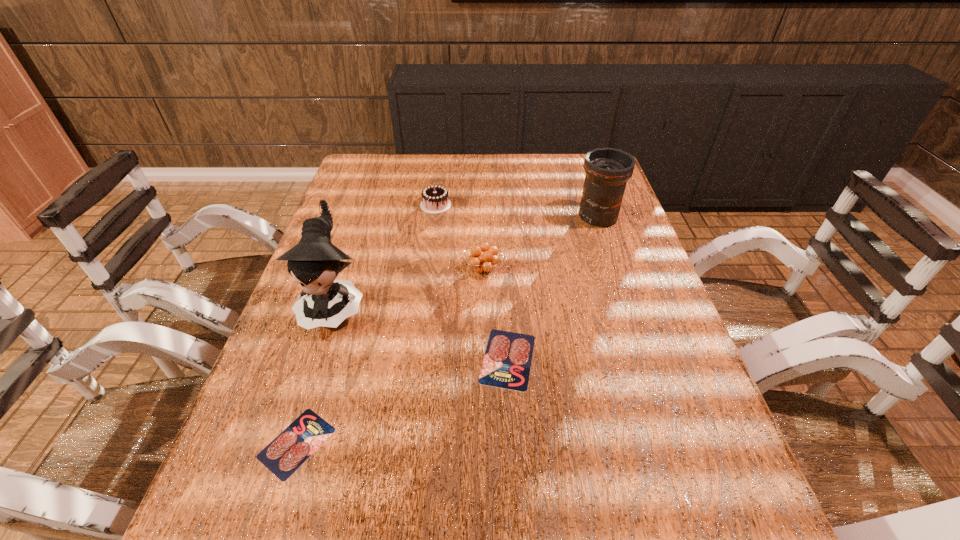
At what (x,y) coordinates should I click in order to perform the action: click on vacant space at the far edge of the desktop. Please return your answer as a coordinate pair (x, y). The image size is (960, 540). Looking at the image, I should click on (504, 160).

At what (x,y) coordinates should I click in order to perform the action: click on vacant area at the near edge. Please return your answer as a coordinate pair (x, y). Image resolution: width=960 pixels, height=540 pixels. Looking at the image, I should click on (563, 435).

At what (x,y) coordinates should I click in order to perform the action: click on free space at the left edge. Please return your answer as a coordinate pair (x, y). Looking at the image, I should click on (321, 364).

Locate an element on the screen. This screenshot has width=960, height=540. vacant space at the right edge of the desktop is located at coordinates [609, 261].

In the image, there is a desktop. Where is `vacant space at the far left corner`? vacant space at the far left corner is located at coordinates (379, 167).

Image resolution: width=960 pixels, height=540 pixels. In order to click on vacant region at the near right corner of the desktop in this screenshot , I will do `click(688, 461)`.

This screenshot has width=960, height=540. I want to click on unoccupied area between the nearest object and the right salami, so click(402, 401).

The height and width of the screenshot is (540, 960). What are the coordinates of `free space between the rightmost object and the tallest object` in the screenshot? It's located at (467, 261).

Locate an element on the screen. Image resolution: width=960 pixels, height=540 pixels. vacant area that lies between the orange fruit and the second shortest object is located at coordinates (495, 314).

Find the location of a particular element. unoccupied position between the chocolate cake and the telephoto lens is located at coordinates (516, 211).